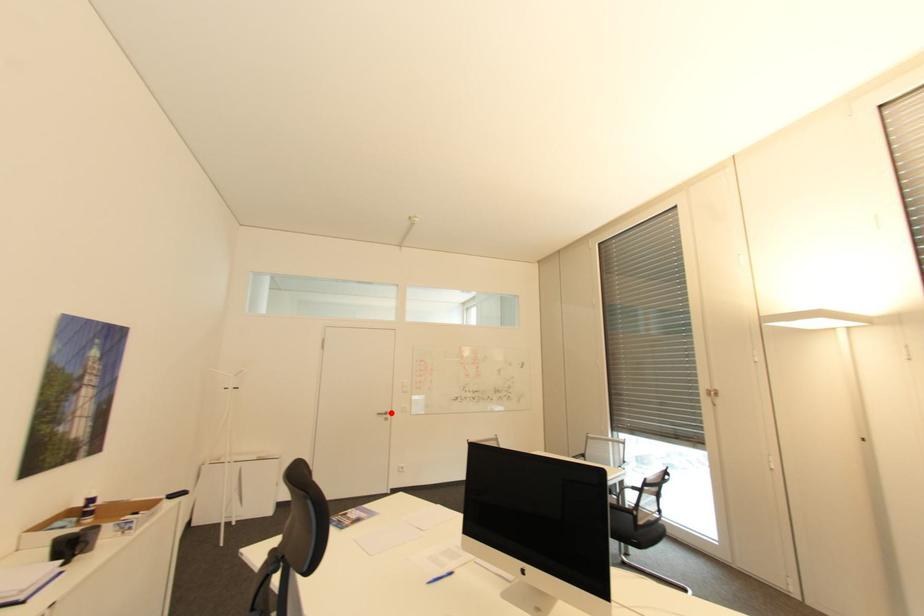
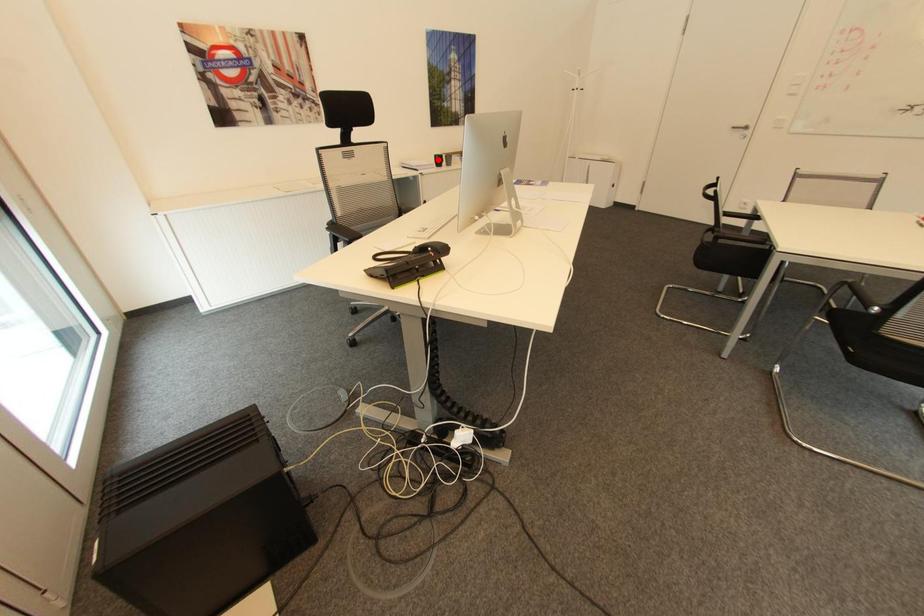
I am providing you with two images of the same scene from different viewpoints. A red point is marked on the first image and another point is marked on the second image. Does the point marked in image1 correspond to the same location as the one in image2?

No